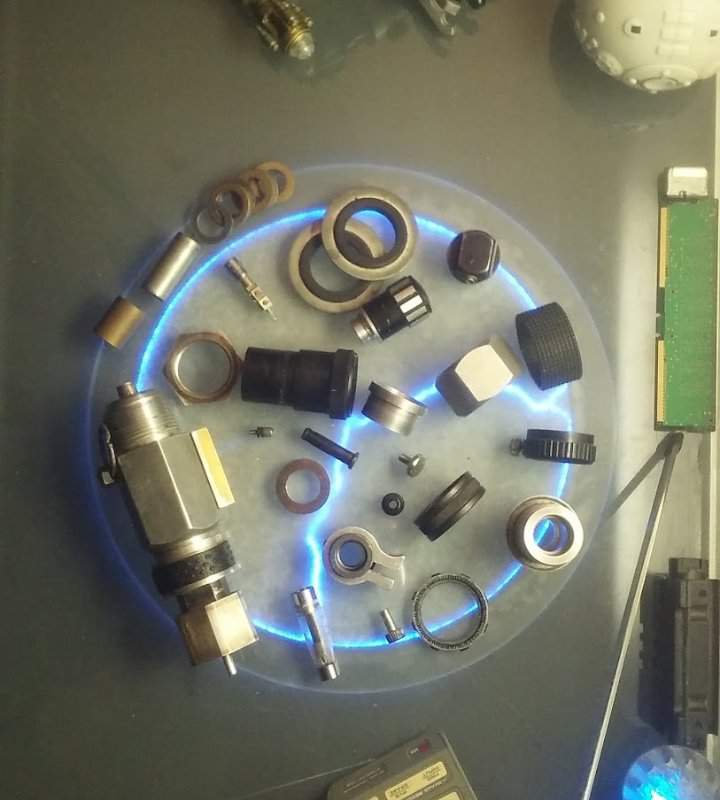
What are the coordinates of `table` in the screenshot? It's located at (98, 121).